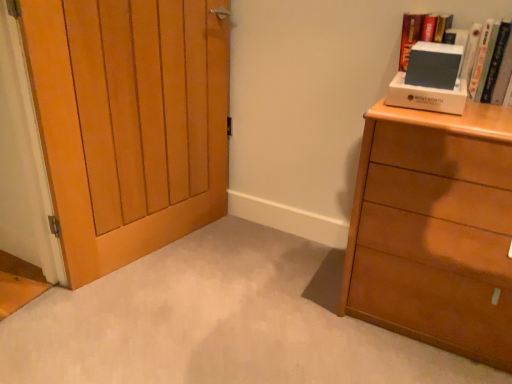
Locate an element on the screen. This screenshot has width=512, height=384. free space in front of wooden door at left is located at coordinates (141, 304).